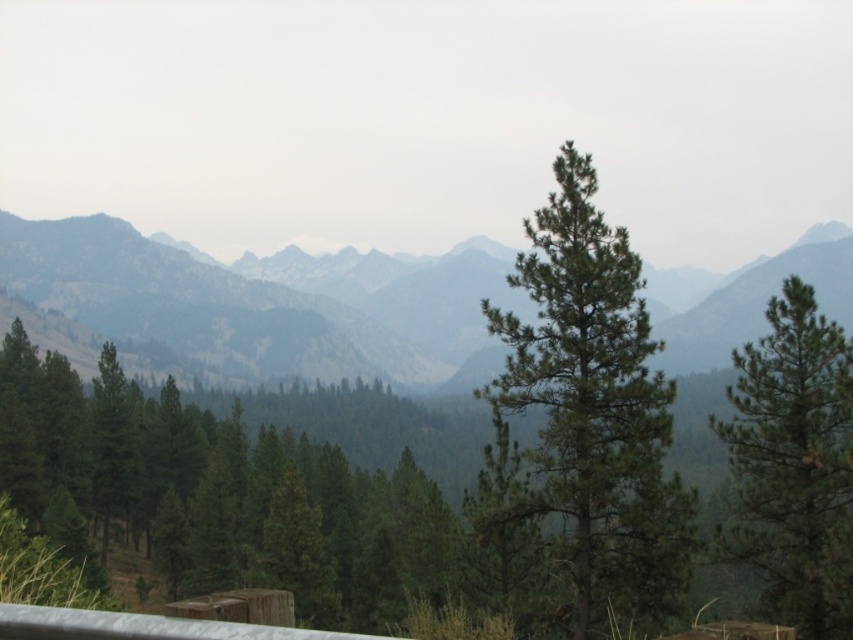
You are a hiker planning to take a photo of the gray textured mountains at center and the silver metallic rail at lower left. Which object should you focus on first if you want both to be in sharp focus?

The gray textured mountains at center should be focused on first because they are farther away than the silver metallic rail at lower left, so focusing on the distant object first ensures both are in focus when using depth of field techniques.

You are hiking in the mountainous landscape and want to cross the valley. You notice the gray textured mountains at center and the silver metallic rail at lower left. Which of these two objects is wider when viewed from your current position?

The gray textured mountains at center is wider than the silver metallic rail at lower left.

You are an astronomer analyzing the image. You need to locate the gray textured mountains at center in the image. What are their coordinates?

The gray textured mountains at center are located at coordinates point (x=265, y=298).